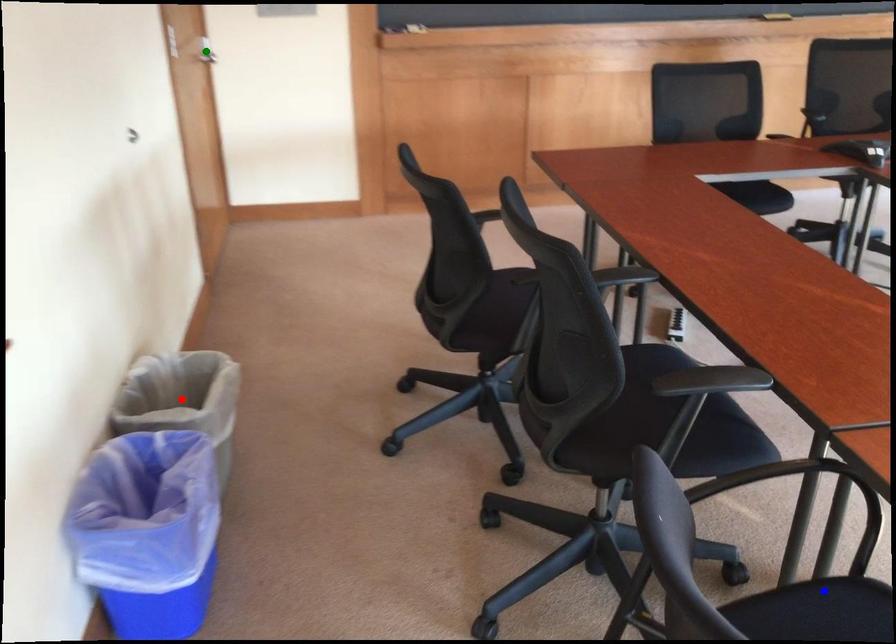
Order these from nearest to farthest:
red point | green point | blue point

blue point → red point → green point